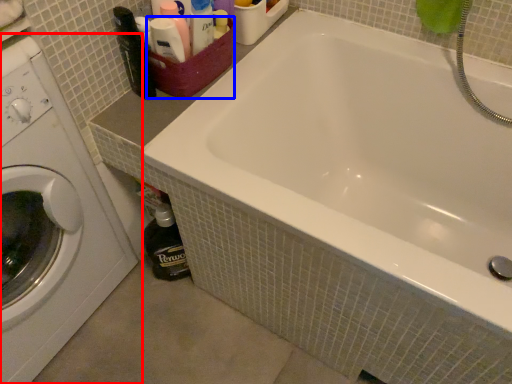
Question: Which object appears closest to the camera in this image, washing machine (highlighted by a red box) or basket (highlighted by a blue box)?

Choices:
 (A) washing machine
 (B) basket

Answer: (A)